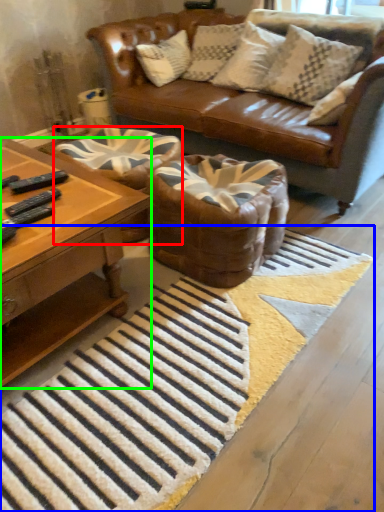
Question: Considering the real-world distances, which object is farthest from swivel chair (highlighted by a red box)? doormat (highlighted by a blue box) or coffee table (highlighted by a green box)?

Choices:
 (A) doormat
 (B) coffee table

Answer: (A)